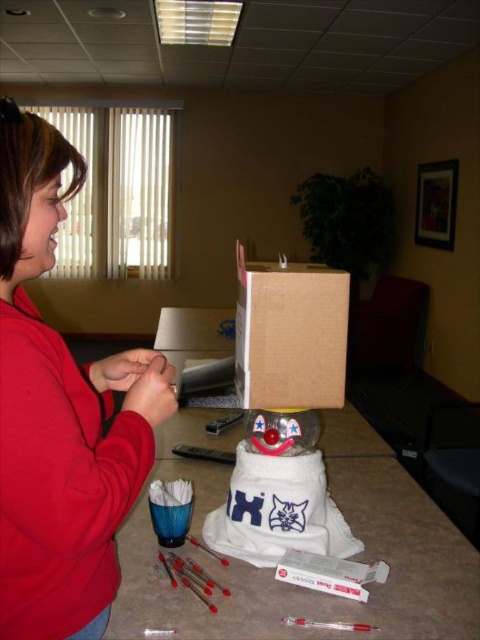
Question: Which point is farther from the camera taking this photo?

Choices:
 (A) (220, 548)
 (B) (80, 420)

Answer: (A)

Question: Observing the image, what is the correct spatial positioning of red fleece sweatshirt at left in reference to translucent plastic snowman at center?

Choices:
 (A) left
 (B) right

Answer: (A)

Question: Is translucent plastic table at center to the left of translucent plastic snowman at center from the viewer's perspective?

Choices:
 (A) no
 (B) yes

Answer: (B)

Question: Can you confirm if translucent plastic table at center is positioned below brown cardboard box at center?

Choices:
 (A) no
 (B) yes

Answer: (B)

Question: Estimate the real-world distances between objects in this image. Which object is closer to the red fleece sweatshirt at left?

Choices:
 (A) translucent plastic snowman at center
 (B) translucent plastic table at center

Answer: (A)

Question: Which object appears closest to the camera in this image?

Choices:
 (A) brown cardboard box at center
 (B) translucent plastic table at center
 (C) red fleece sweatshirt at left
 (D) translucent plastic snowman at center

Answer: (C)